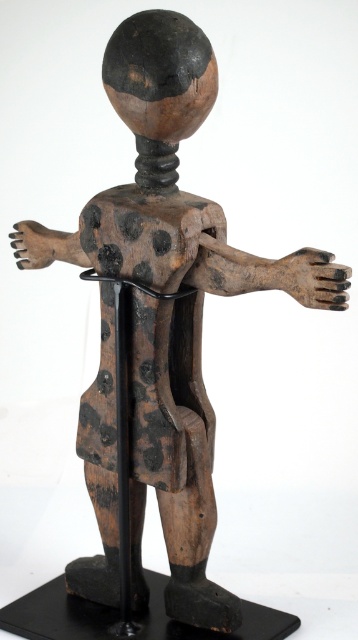
Looking at this image, is black wood pole at center taller than dark brown wood hand at right?

Yes, black wood pole at center is taller than dark brown wood hand at right.

Between black wood pole at center and dark brown wood hand at right, which one is positioned lower?

black wood pole at center

Identify the location of black wood pole at center. (123, 456).

Is black wood pole at center thinner than brown wood hand at left?

Yes.

Which is below, black wood pole at center or brown wood hand at left?

black wood pole at center is lower down.

Which is in front, point (136, 632) or point (44, 230)?

Positioned in front is point (44, 230).

Where is `black wood pole at center`? black wood pole at center is located at coordinates (123, 456).

Which is below, dark brown wood hand at right or brown wood hand at left?

Positioned lower is dark brown wood hand at right.

Can you confirm if dark brown wood hand at right is positioned below brown wood hand at left?

Yes, dark brown wood hand at right is below brown wood hand at left.

Between point (318, 257) and point (46, 259), which one is positioned behind?

Point (46, 259)

Identify the location of dark brown wood hand at right. (312, 278).